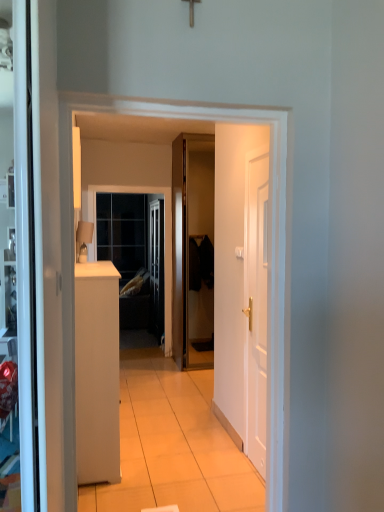
What do you see at coordinates (181, 244) in the screenshot?
I see `glossy wood door at center, marked as the 1th door in a left-to-right arrangement` at bounding box center [181, 244].

Find the location of a particular element. matte beige lampshade at left is located at coordinates (83, 239).

What do you see at coordinates (256, 305) in the screenshot?
I see `white matte door at right, which ranks as the first door in right-to-left order` at bounding box center [256, 305].

Image resolution: width=384 pixels, height=512 pixels. I want to click on white matte door at right, which ranks as the first door in right-to-left order, so click(x=256, y=305).

What is the approximate width of white matte cabinet at left?

The width of white matte cabinet at left is 12.29 inches.

At what (x,y) coordinates should I click in order to perform the action: click on glossy wood door at center, the second door from the right. Please return your answer as a coordinate pair (x, y). This screenshot has height=512, width=384. Looking at the image, I should click on (181, 244).

In the scene shown: Considering the sizes of white matte door at right, the 2th door in the back-to-front sequence, and white matte cabinet at left in the image, is white matte door at right, the 2th door in the back-to-front sequence, bigger or smaller than white matte cabinet at left?

white matte door at right, the 2th door in the back-to-front sequence, is smaller than white matte cabinet at left.

Consider the image. From the image's perspective, is white matte door at right, which appears as the second door when viewed from the left, located beneath white matte cabinet at left?

Actually, white matte door at right, which appears as the second door when viewed from the left, appears above white matte cabinet at left in the image.

The width and height of the screenshot is (384, 512). What are the coordinates of `cabinetry to the left of white matte door at right, which ranks as the first door in right-to-left order` in the screenshot? It's located at (97, 372).

In the scene shown: In the image, is white matte door at right, the 2th door in the back-to-front sequence, positioned in front of or behind white matte cabinet at left?

Clearly, white matte door at right, the 2th door in the back-to-front sequence, is in front of white matte cabinet at left.

Which object is further away from the camera taking this photo, clear glass window at center or glossy wood door at center, placed as the first door when sorted from back to front?

clear glass window at center is further from the camera.

Would you say clear glass window at center is inside or outside glossy wood door at center, the second door positioned from the front?

clear glass window at center is spatially situated outside glossy wood door at center, the second door positioned from the front.

In the image, there is a glossy wood door at center, the second door positioned from the front. Where is `window below it (from a real-world perspective)`? Image resolution: width=384 pixels, height=512 pixels. window below it (from a real-world perspective) is located at coordinates (135, 255).

Does clear glass window at center have a lesser height compared to glossy wood door at center, placed as the first door when sorted from back to front?

Yes.

Is clear glass window at center inside matte beige lampshade at left?

No, clear glass window at center is not inside matte beige lampshade at left.

From a real-world perspective, is matte beige lampshade at left beneath clear glass window at center?

No, from a real-world perspective, matte beige lampshade at left is not below clear glass window at center.

Does matte beige lampshade at left have a greater width compared to clear glass window at center?

Correct, the width of matte beige lampshade at left exceeds that of clear glass window at center.

From the image's perspective, between matte beige lampshade at left and clear glass window at center, which one is located above?

matte beige lampshade at left is shown above in the image.

Could you tell me if white matte door at right, marked as the 1th door in a front-to-back arrangement, is facing matte beige lampshade at left?

No, white matte door at right, marked as the 1th door in a front-to-back arrangement, is not aimed at matte beige lampshade at left.

In the scene shown: From a real-world perspective, between white matte door at right, marked as the 1th door in a front-to-back arrangement, and matte beige lampshade at left, who is vertically lower?

white matte door at right, marked as the 1th door in a front-to-back arrangement, is physically lower.

Is white matte door at right, marked as the 1th door in a front-to-back arrangement, smaller than matte beige lampshade at left?

Incorrect, white matte door at right, marked as the 1th door in a front-to-back arrangement, is not smaller in size than matte beige lampshade at left.

Is white matte door at right, which appears as the second door when viewed from the left, inside or outside of matte beige lampshade at left?

white matte door at right, which appears as the second door when viewed from the left, is spatially situated outside matte beige lampshade at left.

From a real-world perspective, is glossy wood door at center, the second door from the right, under clear glass window at center?

No.

Is glossy wood door at center, the second door from the right, beside clear glass window at center?

No, glossy wood door at center, the second door from the right, is not with clear glass window at center.

Which is in front, point (182, 253) or point (125, 265)?

Positioned in front is point (182, 253).

Is glossy wood door at center, marked as the 1th door in a left-to-right arrangement, oriented towards white matte cabinet at left?

No, glossy wood door at center, marked as the 1th door in a left-to-right arrangement, is not oriented towards white matte cabinet at left.

Based on the photo, in the image, is glossy wood door at center, marked as the 1th door in a left-to-right arrangement, positioned in front of or behind white matte cabinet at left?

In the image, glossy wood door at center, marked as the 1th door in a left-to-right arrangement, appears behind white matte cabinet at left.

I want to click on the 2nd door above the white matte cabinet at left (from a real-world perspective), so click(181, 244).

Which is closer to the camera, (173,309) or (89,329)?

Clearly, point (173,309) is more distant from the camera than point (89,329).

Does glossy wood door at center, placed as the first door when sorted from back to front, appear on the left side of white matte door at right, which appears as the second door when viewed from the left?

Indeed, glossy wood door at center, placed as the first door when sorted from back to front, is positioned on the left side of white matte door at right, which appears as the second door when viewed from the left.

Is glossy wood door at center, the second door from the right, facing towards white matte door at right, which appears as the second door when viewed from the left?

Yes, glossy wood door at center, the second door from the right, is aimed at white matte door at right, which appears as the second door when viewed from the left.

From the picture: Are glossy wood door at center, marked as the 1th door in a left-to-right arrangement, and white matte door at right, which ranks as the first door in right-to-left order, far apart?

Indeed, glossy wood door at center, marked as the 1th door in a left-to-right arrangement, is not near white matte door at right, which ranks as the first door in right-to-left order.

Considering the relative sizes of glossy wood door at center, placed as the first door when sorted from back to front, and white matte door at right, the 2th door in the back-to-front sequence, in the image provided, is glossy wood door at center, placed as the first door when sorted from back to front, bigger than white matte door at right, the 2th door in the back-to-front sequence,?

Yes.

Locate an element on the screen. The image size is (384, 512). the 1st door above when counting from the white matte cabinet at left (from the image's perspective) is located at coordinates (256, 305).

Locate an element on the screen. This screenshot has height=512, width=384. window below the glossy wood door at center, the second door positioned from the front (from a real-world perspective) is located at coordinates (135, 255).

Based on their spatial positions, is matte beige lampshade at left or glossy wood door at center, placed as the first door when sorted from back to front, closer to white matte door at right, the 2th door in the back-to-front sequence?

matte beige lampshade at left is closer to white matte door at right, the 2th door in the back-to-front sequence.

Based on their spatial positions, is white matte door at right, which ranks as the first door in right-to-left order, or white matte cabinet at left closer to matte beige lampshade at left?

white matte cabinet at left is closer to matte beige lampshade at left.

Estimate the real-world distances between objects in this image. Which object is closer to white matte door at right, marked as the 1th door in a front-to-back arrangement, clear glass window at center or white matte cabinet at left?

Among the two, white matte cabinet at left is located nearer to white matte door at right, marked as the 1th door in a front-to-back arrangement.

Looking at the image, which one is located closer to white matte cabinet at left, matte beige lampshade at left or white matte door at right, which ranks as the first door in right-to-left order?

Among the two, matte beige lampshade at left is located nearer to white matte cabinet at left.

Based on their spatial positions, is white matte door at right, which ranks as the first door in right-to-left order, or matte beige lampshade at left further from glossy wood door at center, marked as the 1th door in a left-to-right arrangement?

The object further to glossy wood door at center, marked as the 1th door in a left-to-right arrangement, is white matte door at right, which ranks as the first door in right-to-left order.

Based on their spatial positions, is matte beige lampshade at left or white matte door at right, the 2th door in the back-to-front sequence, further from glossy wood door at center, placed as the first door when sorted from back to front?

white matte door at right, the 2th door in the back-to-front sequence, is further to glossy wood door at center, placed as the first door when sorted from back to front.

Based on their spatial positions, is white matte door at right, marked as the 1th door in a front-to-back arrangement, or matte beige lampshade at left further from clear glass window at center?

white matte door at right, marked as the 1th door in a front-to-back arrangement, lies further to clear glass window at center than the other object.

From the image, which object appears to be farther from matte beige lampshade at left, white matte cabinet at left or glossy wood door at center, the second door from the right?

glossy wood door at center, the second door from the right, lies further to matte beige lampshade at left than the other object.

Find the location of a particular element. Image resolution: width=384 pixels, height=512 pixels. door between matte beige lampshade at left and clear glass window at center from front to back is located at coordinates (181, 244).

At what (x,y) coordinates should I click in order to perform the action: click on door between white matte cabinet at left and clear glass window at center in the front-back direction. Please return your answer as a coordinate pair (x, y). Image resolution: width=384 pixels, height=512 pixels. Looking at the image, I should click on (181, 244).

Locate an element on the screen. The width and height of the screenshot is (384, 512). lamp between white matte cabinet at left and glossy wood door at center, placed as the first door when sorted from back to front, along the z-axis is located at coordinates (83, 239).

At what (x,y) coordinates should I click in order to perform the action: click on lamp between white matte cabinet at left and clear glass window at center along the z-axis. Please return your answer as a coordinate pair (x, y). The image size is (384, 512). Looking at the image, I should click on (83, 239).